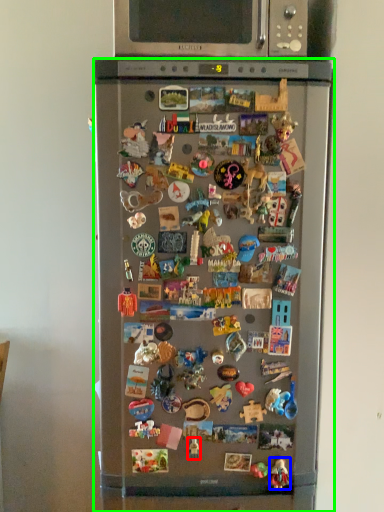
Question: Based on their relative distances, which object is nearer to toy (highlighted by a red box)? Choose from toy (highlighted by a blue box) and refrigerator (highlighted by a green box).

Choices:
 (A) toy
 (B) refrigerator

Answer: (A)